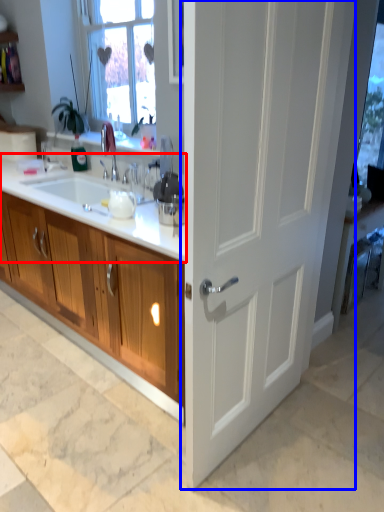
Question: Which object is further to the camera taking this photo, countertop (highlighted by a red box) or door (highlighted by a blue box)?

Choices:
 (A) countertop
 (B) door

Answer: (A)